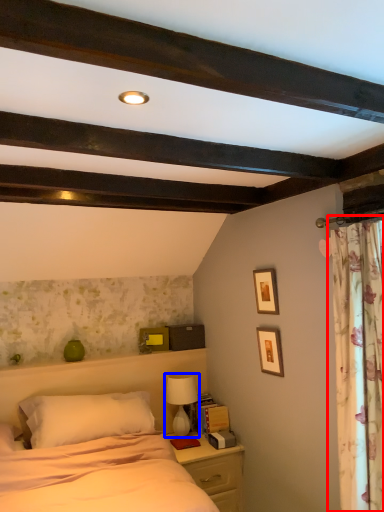
Question: Which object is closer to the camera taking this photo, curtain (highlighted by a red box) or table lamp (highlighted by a blue box)?

Choices:
 (A) curtain
 (B) table lamp

Answer: (A)